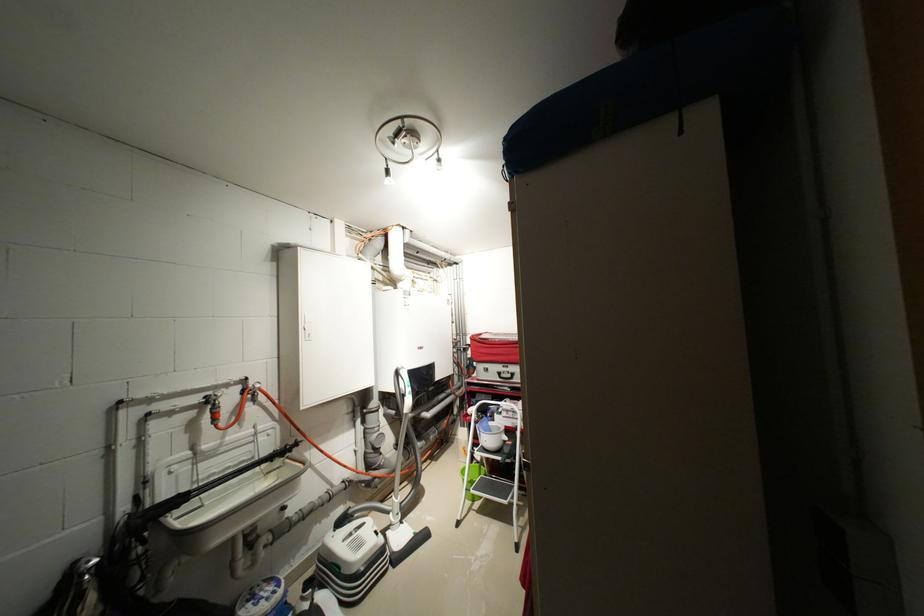
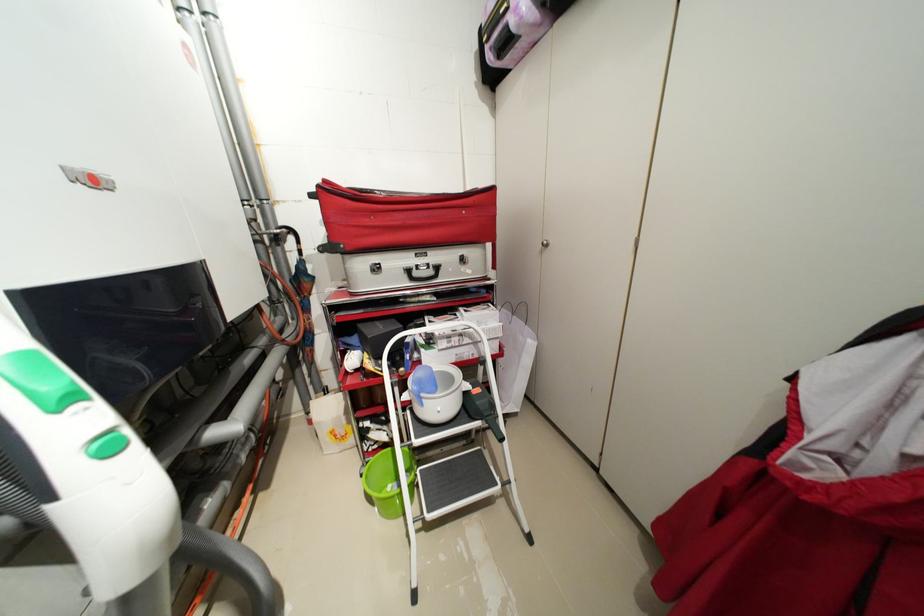
Find the pixel in the second image that matches point 517,444 in the first image.

(484, 391)